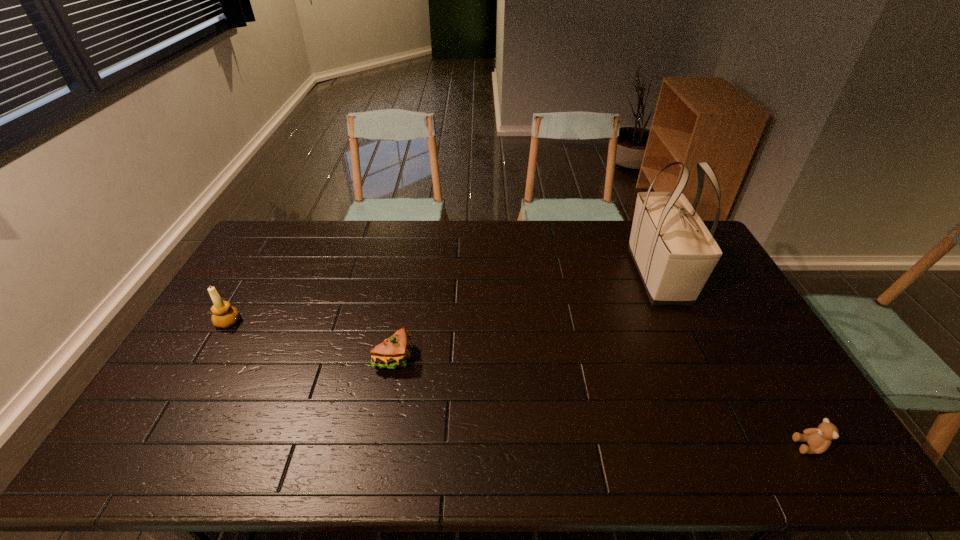
The image size is (960, 540). I want to click on object situated at the near right corner, so click(x=819, y=439).

In the image, there is a desktop. Where is `vacant space at the far edge`? The height and width of the screenshot is (540, 960). vacant space at the far edge is located at coordinates (327, 244).

Image resolution: width=960 pixels, height=540 pixels. I want to click on vacant area at the near edge, so click(x=438, y=440).

Image resolution: width=960 pixels, height=540 pixels. In order to click on vacant region at the left edge of the desktop in this screenshot , I will do `click(189, 397)`.

Identify the location of free space at the right edge of the desktop. (719, 266).

At what (x,y) coordinates should I click in order to perform the action: click on vacant area between the third object from right to left and the shopping bag. Please return your answer as a coordinate pair (x, y). The image size is (960, 540). Looking at the image, I should click on (526, 317).

Locate an element on the screen. The image size is (960, 540). free point between the tallest object and the teddy bear is located at coordinates (733, 361).

Where is `free point between the shopping bag and the rightmost object`? The image size is (960, 540). free point between the shopping bag and the rightmost object is located at coordinates (733, 361).

I want to click on vacant space that is in between the candle_holder and the rightmost object, so click(519, 384).

What are the coordinates of `vacant area that lies between the third shortest object and the second object from left to right` in the screenshot? It's located at (311, 340).